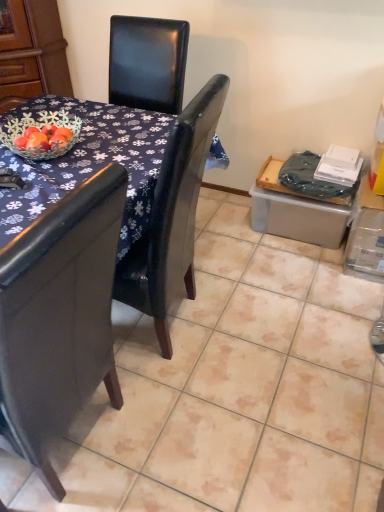
Question: From a real-world perspective, is brushed wood armoire at upper left physically above black leather chair at upper center?

Choices:
 (A) yes
 (B) no

Answer: (A)

Question: Is brushed wood armoire at upper left smaller than black leather chair at upper center?

Choices:
 (A) yes
 (B) no

Answer: (A)

Question: Considering the relative sizes of brushed wood armoire at upper left and black leather chair at upper center in the image provided, is brushed wood armoire at upper left wider than black leather chair at upper center?

Choices:
 (A) no
 (B) yes

Answer: (A)

Question: Can we say brushed wood armoire at upper left lies outside black leather chair at upper center?

Choices:
 (A) yes
 (B) no

Answer: (A)

Question: Is brushed wood armoire at upper left closer to camera compared to black leather chair at upper center?

Choices:
 (A) no
 (B) yes

Answer: (A)

Question: Choose the correct answer: Is black leather chair at upper center inside glossy dark wood table at center or outside it?

Choices:
 (A) inside
 (B) outside

Answer: (A)

Question: Is point (119, 253) positioned closer to the camera than point (41, 117)?

Choices:
 (A) closer
 (B) farther

Answer: (A)

Question: Considering the positions of black leather chair at upper center and glossy dark wood table at center in the image, is black leather chair at upper center wider or thinner than glossy dark wood table at center?

Choices:
 (A) wide
 (B) thin

Answer: (B)

Question: Considering the positions of black leather chair at upper center and glossy dark wood table at center in the image, is black leather chair at upper center taller or shorter than glossy dark wood table at center?

Choices:
 (A) short
 (B) tall

Answer: (B)

Question: Considering the positions of point (51, 31) and point (112, 188), is point (51, 31) closer or farther from the camera than point (112, 188)?

Choices:
 (A) farther
 (B) closer

Answer: (A)

Question: From a real-world perspective, relative to glossy dark wood table at center, is brushed wood armoire at upper left vertically above or below?

Choices:
 (A) above
 (B) below

Answer: (A)

Question: Looking at the image, does brushed wood armoire at upper left seem bigger or smaller compared to glossy dark wood table at center?

Choices:
 (A) small
 (B) big

Answer: (A)

Question: From the image's perspective, is brushed wood armoire at upper left positioned above or below glossy dark wood table at center?

Choices:
 (A) above
 (B) below

Answer: (A)

Question: From a real-world perspective, is glossy dark wood table at center positioned above or below brushed wood armoire at upper left?

Choices:
 (A) above
 (B) below

Answer: (B)

Question: Looking at their shapes, would you say glossy dark wood table at center is wider or thinner than brushed wood armoire at upper left?

Choices:
 (A) thin
 (B) wide

Answer: (B)